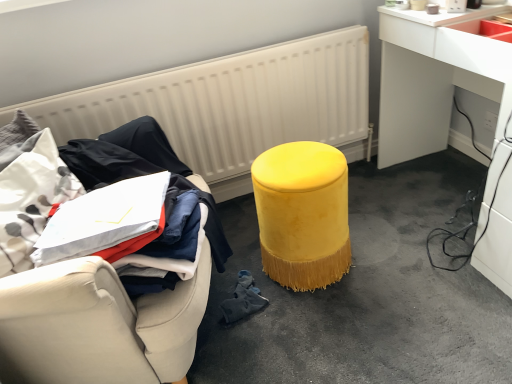
Question: From the image's perspective, is white glossy desk at right on top of velvet yellow stool at center?

Choices:
 (A) yes
 (B) no

Answer: (A)

Question: Does white glossy desk at right have a lesser height compared to velvet yellow stool at center?

Choices:
 (A) no
 (B) yes

Answer: (A)

Question: Can you confirm if white glossy desk at right is smaller than velvet yellow stool at center?

Choices:
 (A) yes
 (B) no

Answer: (B)

Question: Does white glossy desk at right have a larger size compared to velvet yellow stool at center?

Choices:
 (A) no
 (B) yes

Answer: (B)

Question: Is white glossy desk at right taller than velvet yellow stool at center?

Choices:
 (A) yes
 (B) no

Answer: (A)

Question: Is white glossy desk at right outside velvet yellow stool at center?

Choices:
 (A) no
 (B) yes

Answer: (B)

Question: Is velvet yellow stool at center at the back of white glossy desk at right?

Choices:
 (A) yes
 (B) no

Answer: (B)

Question: Considering the relative sizes of white glossy desk at right and velvet yellow stool at center in the image provided, is white glossy desk at right smaller than velvet yellow stool at center?

Choices:
 (A) yes
 (B) no

Answer: (B)

Question: Is white glossy desk at right to the right of velvet yellow stool at center from the viewer's perspective?

Choices:
 (A) no
 (B) yes

Answer: (B)

Question: Is white glossy desk at right thinner than velvet yellow stool at center?

Choices:
 (A) yes
 (B) no

Answer: (A)

Question: Could velvet yellow stool at center be considered to be inside white glossy desk at right?

Choices:
 (A) yes
 (B) no

Answer: (B)

Question: From a real-world perspective, is white glossy desk at right positioned over velvet yellow stool at center based on gravity?

Choices:
 (A) no
 (B) yes

Answer: (B)

Question: From a real-world perspective, is velvet yellow stool at center positioned under white textured radiator at upper center based on gravity?

Choices:
 (A) yes
 (B) no

Answer: (A)